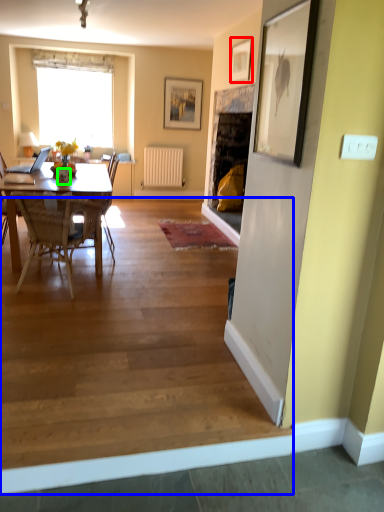
Question: Based on their relative distances, which object is farther from picture frame (highlighted by a red box)? Choose from stair (highlighted by a blue box) and vase (highlighted by a green box).

Choices:
 (A) stair
 (B) vase

Answer: (A)